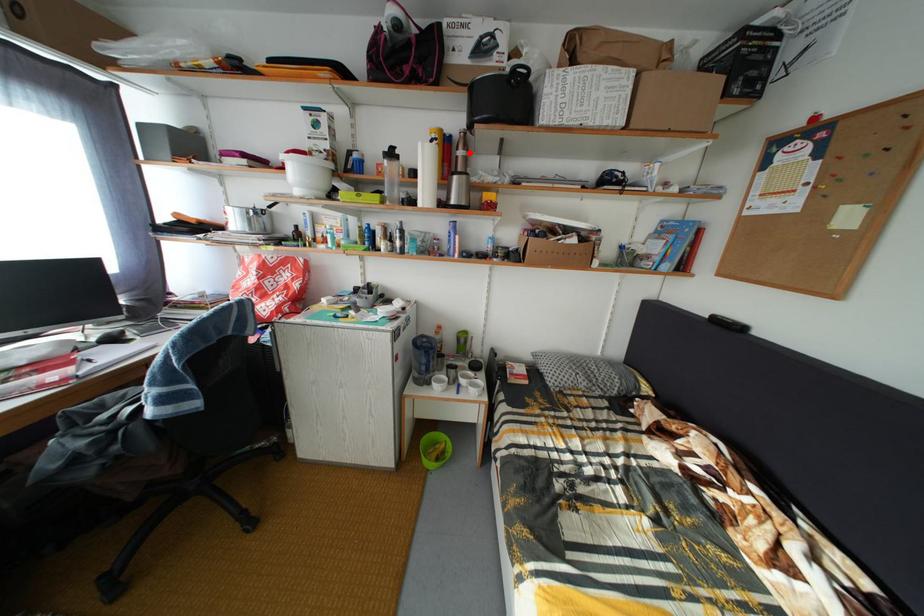
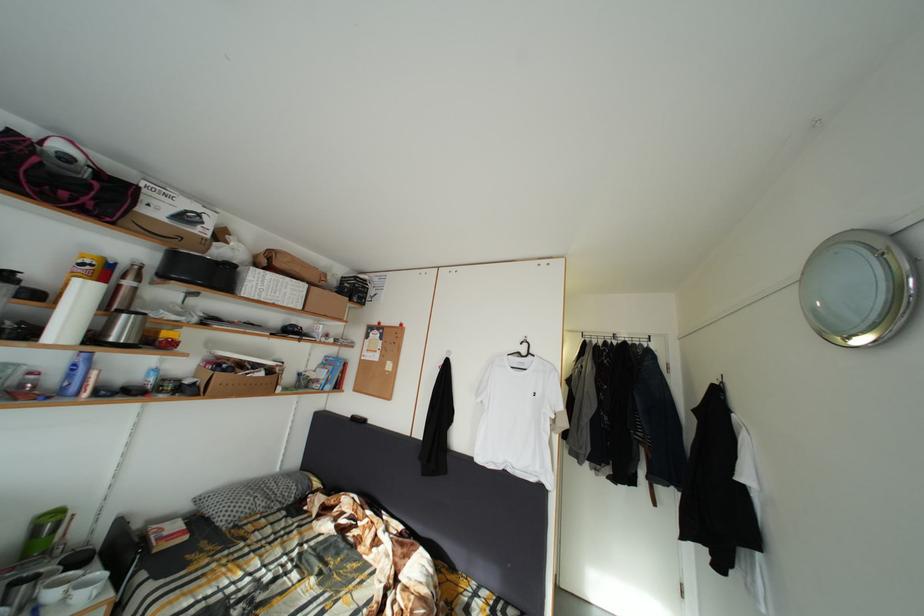
Question: I am providing you with two images of the same scene from different viewpoints. Given a red point in image1, look at the same physical point in image2. Is it:

Choices:
 (A) Closer to the viewpoint
 (B) Farther from the viewpoint

Answer: (B)